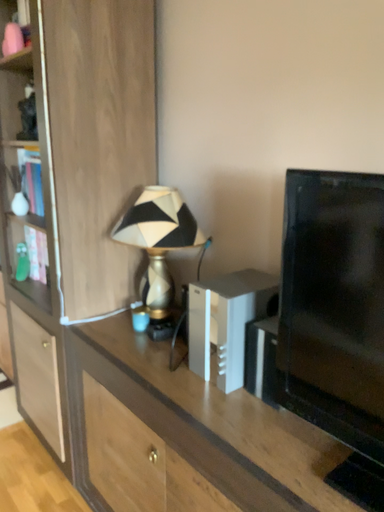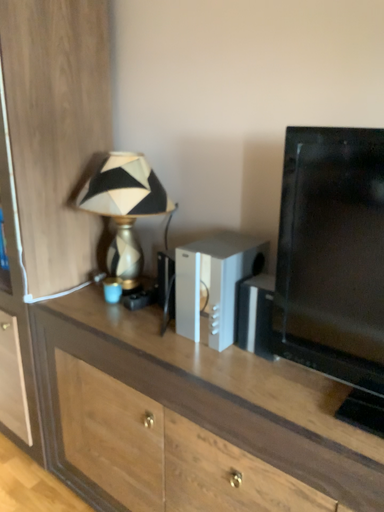
Question: Which way did the camera rotate in the video?

Choices:
 (A) rotated left
 (B) rotated right

Answer: (B)